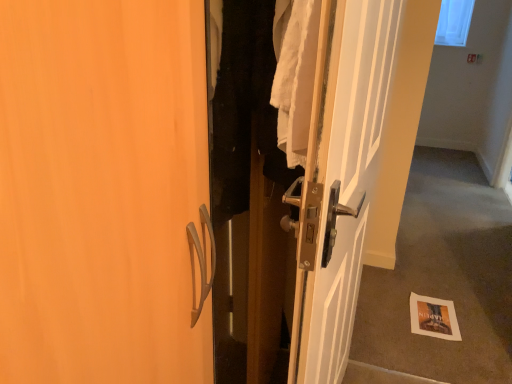
Question: Which is correct: carpeted floor at lower right is inside white glossy door at center, or outside of it?

Choices:
 (A) inside
 (B) outside

Answer: (B)

Question: Is carpeted floor at lower right wider or thinner than white glossy door at center?

Choices:
 (A) wide
 (B) thin

Answer: (B)

Question: Which object is positioned closest to the white glossy door at center?

Choices:
 (A) carpeted floor at lower right
 (B) transparent plastic window screen at upper right
 (C) white paper at lower right

Answer: (C)

Question: Estimate the real-world distances between objects in this image. Which object is closer to the transparent plastic window screen at upper right?

Choices:
 (A) white paper at lower right
 (B) white glossy door at center
 (C) carpeted floor at lower right

Answer: (C)